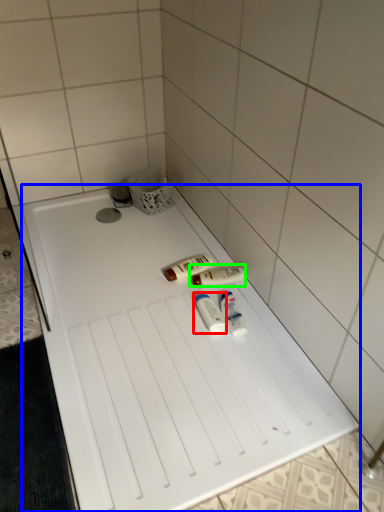
Question: Estimate the real-world distances between objects in this image. Which object is farther from toiletry (highlighted by a red box), furniture (highlighted by a blue box) or toiletry (highlighted by a green box)?

Choices:
 (A) furniture
 (B) toiletry

Answer: (A)